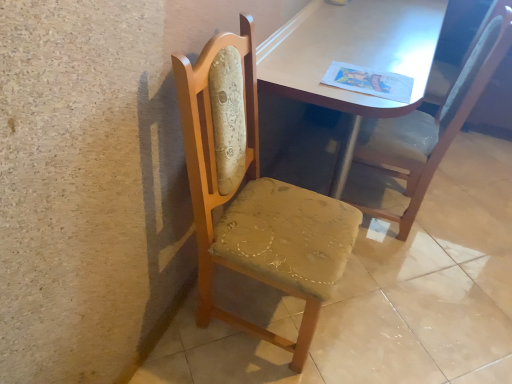
Question: Is woodenchair at left, the 2th chair in the right-to-left sequence, further to the viewer compared to wooden chair at center?

Choices:
 (A) no
 (B) yes

Answer: (A)

Question: Is woodenchair at left, the 1th chair in the left-to-right sequence, facing away from wooden chair at center?

Choices:
 (A) yes
 (B) no

Answer: (B)

Question: Considering the relative positions of woodenchair at left, the 1th chair in the left-to-right sequence, and wooden chair at center in the image provided, is woodenchair at left, the 1th chair in the left-to-right sequence, to the left of wooden chair at center from the viewer's perspective?

Choices:
 (A) yes
 (B) no

Answer: (A)

Question: Does woodenchair at left, the 2th chair in the right-to-left sequence, appear on the right side of wooden chair at center?

Choices:
 (A) no
 (B) yes

Answer: (A)

Question: From a real-world perspective, is woodenchair at left, the 2th chair in the right-to-left sequence, physically below wooden chair at center?

Choices:
 (A) yes
 (B) no

Answer: (B)

Question: From the image's perspective, is woodenchair at left, the 2th chair in the right-to-left sequence, beneath wooden chair at center?

Choices:
 (A) yes
 (B) no

Answer: (B)

Question: From the image's perspective, is matte wooden table at center beneath wooden chair at center?

Choices:
 (A) no
 (B) yes

Answer: (A)

Question: Is matte wooden table at center next to wooden chair at center and touching it?

Choices:
 (A) no
 (B) yes

Answer: (A)

Question: Is matte wooden table at center at the left side of wooden chair at center?

Choices:
 (A) no
 (B) yes

Answer: (B)

Question: Can you confirm if matte wooden table at center is thinner than wooden chair at center?

Choices:
 (A) yes
 (B) no

Answer: (A)

Question: Is matte wooden table at center far from wooden chair at center?

Choices:
 (A) yes
 (B) no

Answer: (B)

Question: Is matte wooden table at center aimed at wooden chair at center?

Choices:
 (A) no
 (B) yes

Answer: (A)

Question: Does wooden chair at right, marked as the 2th chair in a left-to-right arrangement, have a smaller size compared to wooden chair at center?

Choices:
 (A) no
 (B) yes

Answer: (B)